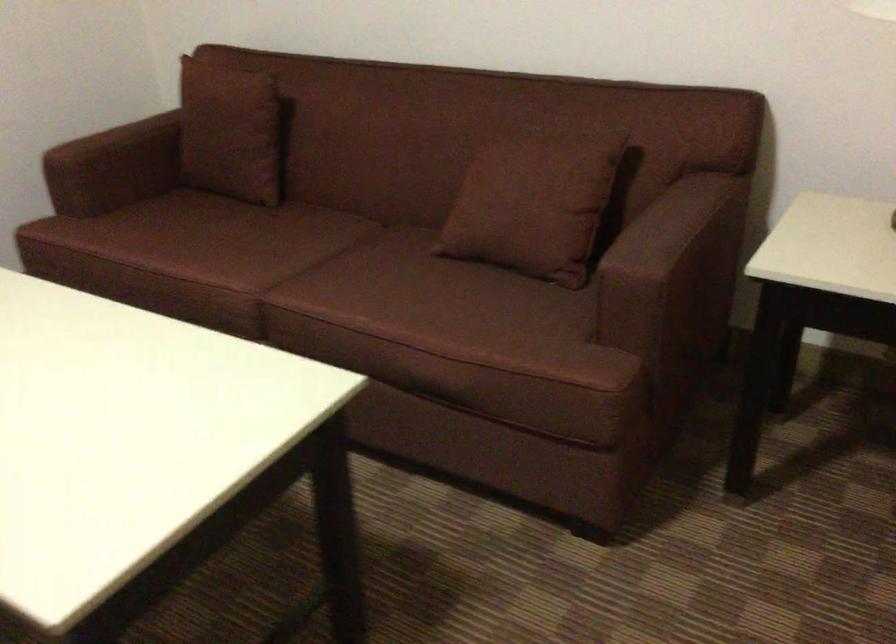
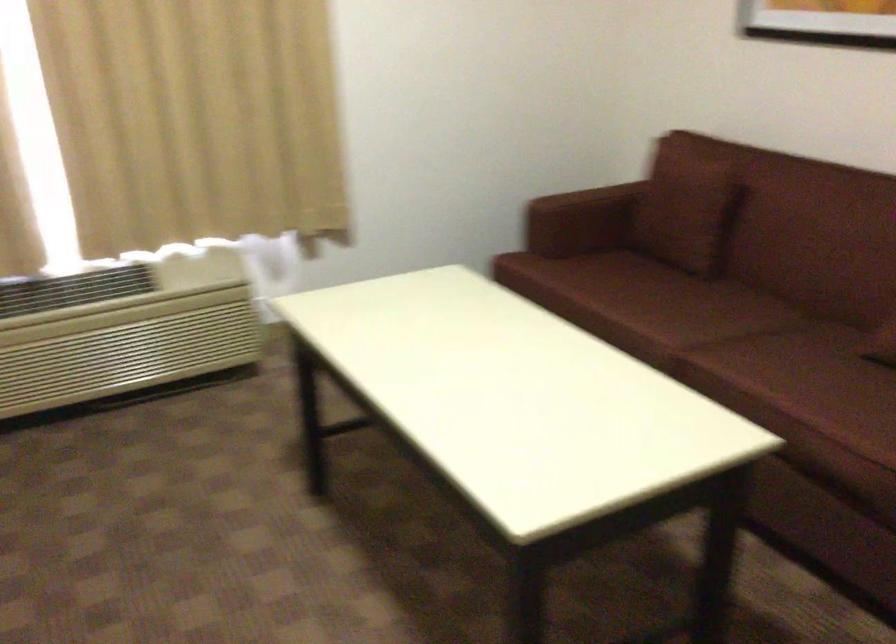
Question: The images are taken continuously from a first-person perspective. In which direction is your viewpoint rotating?

Choices:
 (A) Left
 (B) Right
 (C) Up
 (D) Down

Answer: (A)